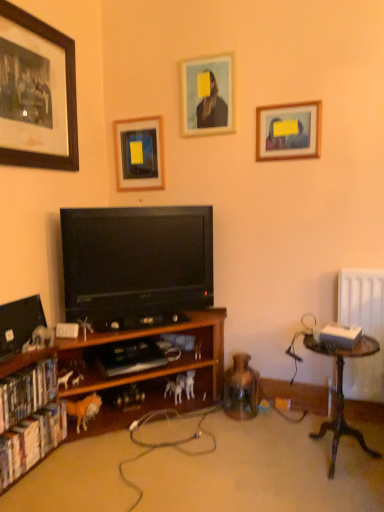
Where is `black glossy television at center`? black glossy television at center is located at coordinates (136, 264).

Describe the element at coordinates (31, 441) in the screenshot. The width and height of the screenshot is (384, 512). I see `hardcover book at lower left, which is the 1th book in bottom-to-top order` at that location.

Measure the distance between point (58,423) and camera.

2.04 meters.

The height and width of the screenshot is (512, 384). What are the coordinates of `wooden framed picture at upper right, acting as the 4th picture frame starting from the left` in the screenshot? It's located at (288, 131).

You are a GUI agent. You are given a task and a screenshot of the screen. Output one action in this format:
    pyautogui.click(x=<x>, y=<y>)
    Task: Click on the white plastic horse at lower left, which ranks as the 3th animal in right-to-left order
    
    Given the screenshot: What is the action you would take?
    pyautogui.click(x=65, y=379)

From the image's perspective, does hardcover books at left, the 2th book ordered from the bottom, appear lower than matte wooden picture frame at upper center, which appears as the third picture frame when viewed from the left?

Yes, from the image's perspective, hardcover books at left, the 2th book ordered from the bottom, is beneath matte wooden picture frame at upper center, which appears as the third picture frame when viewed from the left.

Which object is wider, hardcover books at left, the 2th book ordered from the bottom, or matte wooden picture frame at upper center, which appears as the third picture frame when viewed from the left?

hardcover books at left, the 2th book ordered from the bottom.

Can you confirm if hardcover books at left, the 2th book ordered from the bottom, is bigger than matte wooden picture frame at upper center, placed as the 2th picture frame when sorted from right to left?

Yes, hardcover books at left, the 2th book ordered from the bottom, is bigger than matte wooden picture frame at upper center, placed as the 2th picture frame when sorted from right to left.

How different are the orientations of wooden framed picture at upper right, acting as the 4th picture frame starting from the left, and matte black picture frame at upper left, which is counted as the 4th picture frame, starting from the right, in degrees?

The angle between the facing direction of wooden framed picture at upper right, acting as the 4th picture frame starting from the left, and the facing direction of matte black picture frame at upper left, which is counted as the 4th picture frame, starting from the right, is 90.2 degrees.

Which of these two, wooden framed picture at upper right, which is the 1th picture frame from right to left, or matte black picture frame at upper left, which ranks as the first picture frame in left-to-right order, is wider?

With larger width is matte black picture frame at upper left, which ranks as the first picture frame in left-to-right order.

Can you see wooden framed picture at upper right, acting as the 4th picture frame starting from the left, touching matte black picture frame at upper left, which is counted as the 4th picture frame, starting from the right?

No, wooden framed picture at upper right, acting as the 4th picture frame starting from the left, is not in contact with matte black picture frame at upper left, which is counted as the 4th picture frame, starting from the right.

From the image's perspective, which one is positioned lower, wooden framed picture at upper right, which is the 1th picture frame from right to left, or matte black picture frame at upper left, which is counted as the 4th picture frame, starting from the right?

From the image's view, wooden framed picture at upper right, which is the 1th picture frame from right to left, is below.

Is matte wooden picture frame at upper center, which appears as the third picture frame when viewed from the left, spatially inside hardcover books at left, the 2th book ordered from the bottom, or outside of it?

matte wooden picture frame at upper center, which appears as the third picture frame when viewed from the left, is spatially situated outside hardcover books at left, the 2th book ordered from the bottom.

Does matte wooden picture frame at upper center, which appears as the third picture frame when viewed from the left, turn towards hardcover books at left, marked as the 1th book in a top-to-bottom arrangement?

No, matte wooden picture frame at upper center, which appears as the third picture frame when viewed from the left, is not aimed at hardcover books at left, marked as the 1th book in a top-to-bottom arrangement.

Which is more to the left, matte wooden picture frame at upper center, which appears as the third picture frame when viewed from the left, or hardcover books at left, marked as the 1th book in a top-to-bottom arrangement?

hardcover books at left, marked as the 1th book in a top-to-bottom arrangement.

Which of these two, orange plush horse at lower left, placed as the second animal when sorted from right to left, or wooden picture frame at upper center, which ranks as the third picture frame in right-to-left order, is bigger?

wooden picture frame at upper center, which ranks as the third picture frame in right-to-left order.

Between orange plush horse at lower left, the 2th animal positioned from the front, and wooden picture frame at upper center, which ranks as the third picture frame in right-to-left order, which one is positioned behind?

Positioned behind is wooden picture frame at upper center, which ranks as the third picture frame in right-to-left order.

Which is more to the right, orange plush horse at lower left, placed as the second animal when sorted from right to left, or wooden picture frame at upper center, the 2th picture frame viewed from the left?

wooden picture frame at upper center, the 2th picture frame viewed from the left.

From a real-world perspective, who is located higher, orange plush horse at lower left, the 2th animal positioned from the front, or wooden picture frame at upper center, the 2th picture frame viewed from the left?

wooden picture frame at upper center, the 2th picture frame viewed from the left.

Which object is positioned more to the left, orange plush horse at lower left, placed as the second animal when sorted from right to left, or white plastic horse at lower left, which ranks as the 3th animal in right-to-left order?

white plastic horse at lower left, which ranks as the 3th animal in right-to-left order, is more to the left.

Are orange plush horse at lower left, acting as the 2th animal starting from the back, and white plastic horse at lower left, arranged as the third animal when viewed from the back, beside each other?

orange plush horse at lower left, acting as the 2th animal starting from the back, is not next to white plastic horse at lower left, arranged as the third animal when viewed from the back, and they're not touching.

Would you say orange plush horse at lower left, the 2th animal positioned from the front, is inside or outside white plastic horse at lower left, which ranks as the 3th animal in right-to-left order?

The correct answer is: outside.

From the image's perspective, is white plastic horse at lower left, which appears as the first animal when viewed from the left, above black glossy television at center?

No.

Which object is positioned more to the right, white plastic horse at lower left, which appears as the first animal when viewed from the left, or black glossy television at center?

Positioned to the right is black glossy television at center.

Considering the sizes of objects white plastic horse at lower left, arranged as the third animal when viewed from the back, and black glossy television at center in the image provided, who is taller, white plastic horse at lower left, arranged as the third animal when viewed from the back, or black glossy television at center?

black glossy television at center is taller.

Locate an element on the screen. The width and height of the screenshot is (384, 512). television on the right of the white plastic horse at lower left, the first animal when ordered from front to back is located at coordinates (136, 264).

Which of these two, wooden bookshelf at left or white plastic horse at lower left, which appears as the first animal when viewed from the left, is wider?

wooden bookshelf at left is wider.

From the picture: From the image's perspective, is wooden bookshelf at left located above or below white plastic horse at lower left, which ranks as the 3th animal in right-to-left order?

From the image's perspective, wooden bookshelf at left appears below white plastic horse at lower left, which ranks as the 3th animal in right-to-left order.

From a real-world perspective, is wooden bookshelf at left beneath white plastic horse at lower left, which appears as the first animal when viewed from the left?

Yes, from a real-world perspective, wooden bookshelf at left is under white plastic horse at lower left, which appears as the first animal when viewed from the left.

Locate an element on the screen. animal positioned vertically above the wooden bookshelf at left (from a real-world perspective) is located at coordinates (65, 379).

From the hardcover books at left, the 2th book ordered from the bottom, count 3rd picture frame to the right and point to it. Please provide its 2D coordinates.

[(207, 96)]

Identify the location of picture frame that is the 1st object above the wooden framed picture at upper right, acting as the 4th picture frame starting from the left (from a real-world perspective). This screenshot has height=512, width=384. (36, 93).

When comparing their distances from wooden framed picture at upper right, acting as the 4th picture frame starting from the left, does orange plush horse at lower left, acting as the 2th animal starting from the back, or hardcover book at lower left, which is the 1th book in bottom-to-top order, seem closer?

Based on the image, orange plush horse at lower left, acting as the 2th animal starting from the back, appears to be nearer to wooden framed picture at upper right, acting as the 4th picture frame starting from the left.

Which object lies further to the anchor point hardcover book at lower left, which is the 1th book in bottom-to-top order, white matte horse at lower center, placed as the first animal when sorted from right to left, or matte black picture frame at upper left, which ranks as the first picture frame in left-to-right order?

Based on the image, matte black picture frame at upper left, which ranks as the first picture frame in left-to-right order, appears to be further to hardcover book at lower left, which is the 1th book in bottom-to-top order.

Looking at the image, which one is located closer to wooden table at right, wooden picture frame at upper center, which ranks as the third picture frame in right-to-left order, or wooden framed picture at upper right, which is the 1th picture frame from right to left?

→ wooden framed picture at upper right, which is the 1th picture frame from right to left, is positioned closer to the anchor wooden table at right.

Which object lies further to the anchor point white matte horse at lower center, which is the 1th animal in back-to-front order, wooden table at right or wooden framed picture at upper right, acting as the 4th picture frame starting from the left?

wooden framed picture at upper right, acting as the 4th picture frame starting from the left, is further to white matte horse at lower center, which is the 1th animal in back-to-front order.

Based on their spatial positions, is white plastic horse at lower left, which ranks as the 3th animal in right-to-left order, or wooden picture frame at upper center, which ranks as the third picture frame in right-to-left order, further from wooden bookshelf at left?

wooden picture frame at upper center, which ranks as the third picture frame in right-to-left order, is positioned further to the anchor wooden bookshelf at left.

Looking at the image, which one is located further to matte wooden picture frame at upper center, placed as the 2th picture frame when sorted from right to left, black glossy television at center or hardcover book at lower left, placed as the second book when sorted from top to bottom?

hardcover book at lower left, placed as the second book when sorted from top to bottom, lies further to matte wooden picture frame at upper center, placed as the 2th picture frame when sorted from right to left, than the other object.

When comparing their distances from white plastic horse at lower left, arranged as the third animal when viewed from the back, does hardcover books at left, marked as the 1th book in a top-to-bottom arrangement, or wooden picture frame at upper center, which ranks as the third picture frame in right-to-left order, seem closer?

hardcover books at left, marked as the 1th book in a top-to-bottom arrangement, is closer to white plastic horse at lower left, arranged as the third animal when viewed from the back.

In the scene shown: Which object lies further to the anchor point white matte horse at lower center, the 3th animal in the left-to-right sequence, orange plush horse at lower left, acting as the 2th animal starting from the left, or hardcover book at lower left, which is the 1th book in bottom-to-top order?

hardcover book at lower left, which is the 1th book in bottom-to-top order, is further to white matte horse at lower center, the 3th animal in the left-to-right sequence.

The height and width of the screenshot is (512, 384). I want to click on television between wooden framed picture at upper right, which is the 1th picture frame from right to left, and hardcover book at lower left, which is the 1th book in bottom-to-top order, vertically, so click(136, 264).

The height and width of the screenshot is (512, 384). What are the coordinates of `animal between wooden picture frame at upper center, the 2th picture frame viewed from the left, and wooden table at right in the up-down direction` in the screenshot? It's located at (65, 379).

Locate an element on the screen. television between matte wooden picture frame at upper center, placed as the 2th picture frame when sorted from right to left, and hardcover books at left, the 2th book ordered from the bottom, from top to bottom is located at coordinates (136, 264).

Where is `bookcase between orange plush horse at lower left, the 2th animal positioned from the front, and wooden table at right, in the horizontal direction`? bookcase between orange plush horse at lower left, the 2th animal positioned from the front, and wooden table at right, in the horizontal direction is located at coordinates (141, 371).